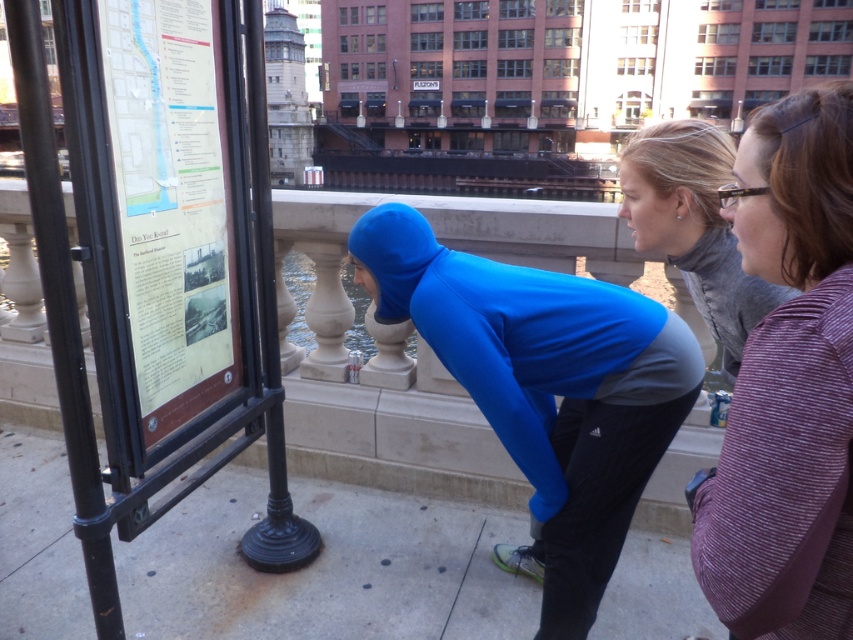
Question: Estimate the real-world distances between objects in this image. Which object is closer to the paper map at left?

Choices:
 (A) smooth concrete pavement at center
 (B) black metal pole at lower left
 (C) black metal pole at left
 (D) gray fleece jacket at upper right

Answer: (C)

Question: Considering the relative positions of striped purple sweater at center and black metal pole at lower left in the image provided, where is striped purple sweater at center located with respect to black metal pole at lower left?

Choices:
 (A) below
 (B) above

Answer: (A)

Question: Which of these objects is positioned closest to the paper map at left?

Choices:
 (A) striped purple sweater at center
 (B) smooth concrete pavement at center
 (C) black metal pole at lower left
 (D) black metal pole at left

Answer: (D)

Question: Is striped purple sweater at center positioned behind paper map at left?

Choices:
 (A) no
 (B) yes

Answer: (A)

Question: Which of the following is the closest to the observer?

Choices:
 (A) (631, 538)
 (B) (828, 490)
 (C) (312, 534)
 (D) (642, 170)

Answer: (B)

Question: Where is blue spandex squat at center located in relation to black metal pole at left in the image?

Choices:
 (A) above
 (B) below

Answer: (B)